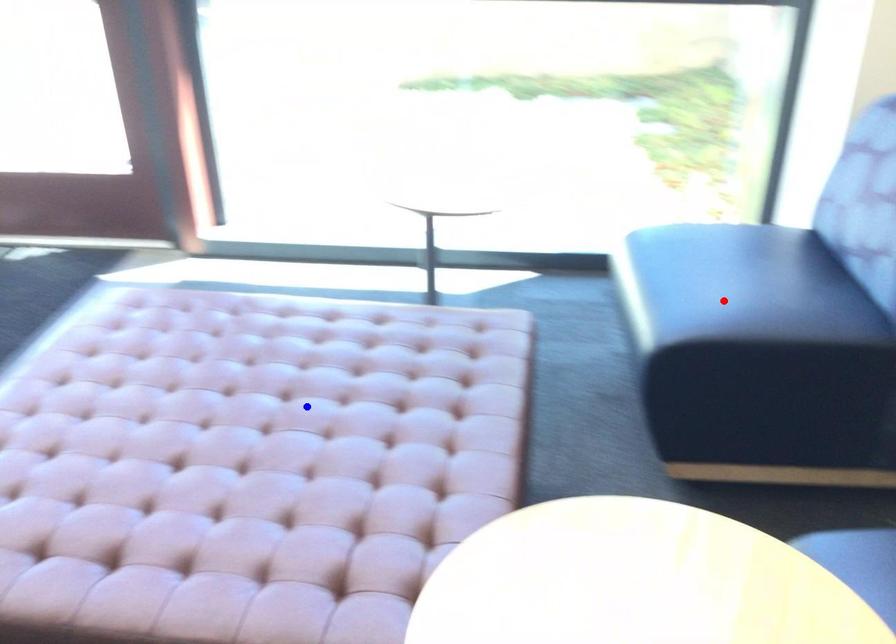
Question: In the image, two points are highlighted. Which point is nearer to the camera? Reply with the corresponding letter.

Choices:
 (A) blue point
 (B) red point

Answer: (A)